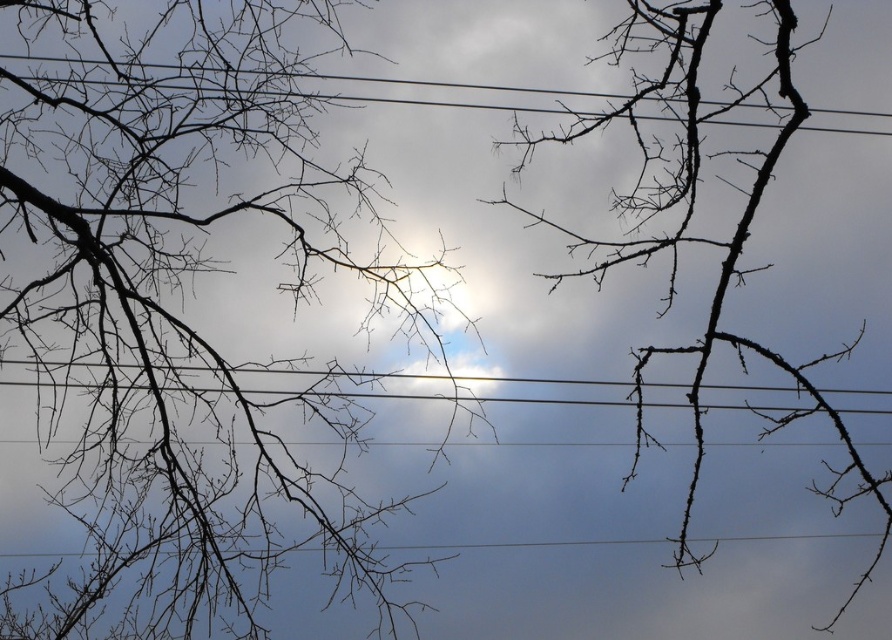
Question: Among these objects, which one is farthest from the camera?

Choices:
 (A) dark brown branches at center
 (B) black wire at upper center

Answer: (B)

Question: Can you confirm if dark brown branches at center is wider than black wire at upper center?

Choices:
 (A) no
 (B) yes

Answer: (A)

Question: Which point is farther to the camera?

Choices:
 (A) (187, 77)
 (B) (881, 490)

Answer: (B)

Question: Which point appears closest to the camera in this image?

Choices:
 (A) (329, 96)
 (B) (841, 611)

Answer: (A)

Question: Is dark brown branches at center to the left of black wire at upper center from the viewer's perspective?

Choices:
 (A) no
 (B) yes

Answer: (A)

Question: Is dark brown branches at center smaller than black wire at upper center?

Choices:
 (A) yes
 (B) no

Answer: (B)